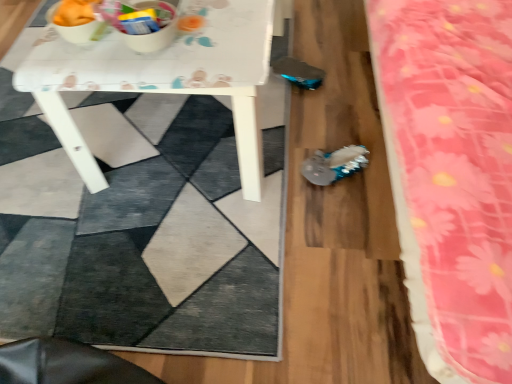
What is the approximate height of pink floral fabric at right?

31.92 inches.

Describe the element at coordinates (162, 78) in the screenshot. I see `white glossy table at center` at that location.

Describe the element at coordinates (334, 164) in the screenshot. I see `shiny metallic shoe at center` at that location.

Identify the location of pink floral fabric at right. (455, 165).

Can you confirm if pink floral fabric at right is bigger than shiny metallic shoe at center?

Yes, pink floral fabric at right is bigger than shiny metallic shoe at center.

Can you confirm if pink floral fabric at right is taller than shiny metallic shoe at center?

Yes, pink floral fabric at right is taller than shiny metallic shoe at center.

Is pink floral fabric at right aimed at shiny metallic shoe at center?

Yes.

Identify the location of bed that is in front of the shiny metallic shoe at center. (455, 165).

Can you confirm if white glossy table at center is shorter than pink floral fabric at right?

Correct, white glossy table at center is not as tall as pink floral fabric at right.

At what (x,y) coordinates should I click in order to perform the action: click on bed below the white glossy table at center (from the image's perspective). Please return your answer as a coordinate pair (x, y). Looking at the image, I should click on (455, 165).

Based on the photo, can you tell me how much white glossy table at center and pink floral fabric at right differ in facing direction?

The angular difference between white glossy table at center and pink floral fabric at right is 90 degrees.

Is white glossy table at center facing towards pink floral fabric at right?

No, white glossy table at center does not turn towards pink floral fabric at right.

Is point (325, 153) positioned before point (241, 75)?

No.

Is shiny metallic shoe at center turned away from white glossy table at center?

That's not correct — shiny metallic shoe at center is not looking away from white glossy table at center.

Considering the relative positions of shiny metallic shoe at center and white glossy table at center in the image provided, is shiny metallic shoe at center in front of white glossy table at center?

That is False.

From the image's perspective, is shiny metallic shoe at center on white glossy table at center?

Incorrect, from the image's perspective, shiny metallic shoe at center is lower than white glossy table at center.

Between white glossy table at center and shiny metallic shoe at center, which one is positioned behind?

shiny metallic shoe at center is further from the camera.

Is shiny metallic shoe at center at the back of white glossy table at center?

No.

Does white glossy table at center have a greater height compared to shiny metallic shoe at center?

Correct, white glossy table at center is much taller as shiny metallic shoe at center.

Measure the distance between white glossy table at center and shiny metallic shoe at center.

white glossy table at center is 47.27 centimeters away from shiny metallic shoe at center.

Considering the relative sizes of shiny metallic shoe at center and pink floral fabric at right in the image provided, is shiny metallic shoe at center thinner than pink floral fabric at right?

Yes.

Does shiny metallic shoe at center lie in front of pink floral fabric at right?

No, the depth of shiny metallic shoe at center is greater than that of pink floral fabric at right.

From the image's perspective, does shiny metallic shoe at center appear higher than pink floral fabric at right?

Incorrect, from the image's perspective, shiny metallic shoe at center is lower than pink floral fabric at right.

In the scene shown: From a real-world perspective, is shiny metallic shoe at center positioned above or below pink floral fabric at right?

Clearly, from a real-world perspective, shiny metallic shoe at center is below pink floral fabric at right.

Is pink floral fabric at right next to white glossy table at center?

No, pink floral fabric at right is not in contact with white glossy table at center.

Is pink floral fabric at right taller or shorter than white glossy table at center?

In the image, pink floral fabric at right appears to be taller than white glossy table at center.

From a real-world perspective, is pink floral fabric at right located higher than white glossy table at center?

Yes, from a real-world perspective, pink floral fabric at right is over white glossy table at center

At what (x,y) coordinates should I click in order to perform the action: click on footwear on the left of pink floral fabric at right. Please return your answer as a coordinate pair (x, y). The width and height of the screenshot is (512, 384). Looking at the image, I should click on (334, 164).

Locate an element on the screen. The height and width of the screenshot is (384, 512). table above the pink floral fabric at right (from the image's perspective) is located at coordinates (162, 78).

Looking at this image, when comparing their distances from pink floral fabric at right, does shiny metallic shoe at center or white glossy table at center seem closer?

shiny metallic shoe at center is closer to pink floral fabric at right.

From the image, which object appears to be nearer to white glossy table at center, shiny metallic shoe at center or pink floral fabric at right?

shiny metallic shoe at center is closer to white glossy table at center.

Which object lies nearer to the anchor point white glossy table at center, pink floral fabric at right or shiny metallic shoe at center?

The object closer to white glossy table at center is shiny metallic shoe at center.

Looking at the image, which one is located further to shiny metallic shoe at center, pink floral fabric at right or white glossy table at center?

pink floral fabric at right is positioned further to the anchor shiny metallic shoe at center.

In the scene shown: Which object lies nearer to the anchor point shiny metallic shoe at center, white glossy table at center or pink floral fabric at right?

The object closer to shiny metallic shoe at center is white glossy table at center.

Which object lies further to the anchor point pink floral fabric at right, white glossy table at center or shiny metallic shoe at center?

The object further to pink floral fabric at right is white glossy table at center.

Where is `table between pink floral fabric at right and shiny metallic shoe at center along the z-axis`? Image resolution: width=512 pixels, height=384 pixels. table between pink floral fabric at right and shiny metallic shoe at center along the z-axis is located at coordinates (162, 78).